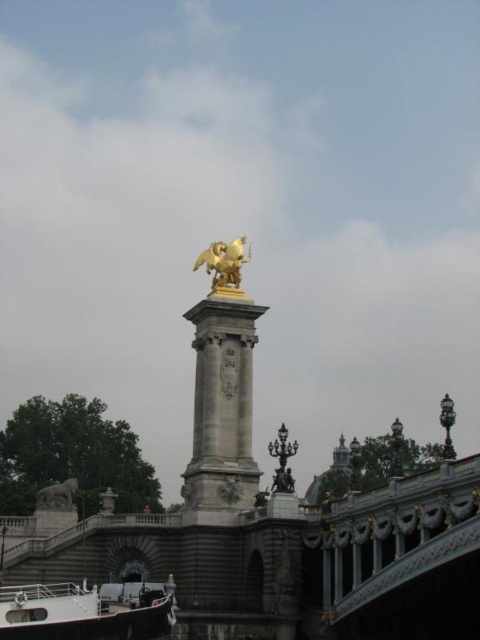
How much distance is there between gold polished statue at center and gold polished statue at upper center?

gold polished statue at center and gold polished statue at upper center are 7.09 meters apart from each other.

Is gold polished statue at center smaller than gold polished statue at upper center?

Actually, gold polished statue at center might be larger than gold polished statue at upper center.

You are a GUI agent. You are given a task and a screenshot of the screen. Output one action in this format:
    pyautogui.click(x=<x>, y=<y>)
    Task: Click on the gold polished statue at center
    
    Given the screenshot: What is the action you would take?
    pyautogui.click(x=223, y=385)

This screenshot has width=480, height=640. What are the coordinates of `gold polished statue at center` in the screenshot? It's located at (223, 385).

Which is above, gold polished statue at center or white matte boat at lower left?

gold polished statue at center

Is point (190, 508) closer to camera compared to point (116, 625)?

No, (190, 508) is further to viewer.

Between point (237, 480) and point (140, 624), which one is positioned behind?

Positioned behind is point (237, 480).

Find the location of a particular element. The height and width of the screenshot is (640, 480). gold polished statue at center is located at coordinates (223, 385).

Can you confirm if white matte boat at lower left is positioned above gold polished statue at upper center?

Incorrect, white matte boat at lower left is not positioned above gold polished statue at upper center.

Can you confirm if white matte boat at lower left is positioned below gold polished statue at upper center?

Correct, white matte boat at lower left is located below gold polished statue at upper center.

Is point (26, 593) positioned behind point (239, 240)?

No, (26, 593) is closer to viewer.

Locate an element on the screen. Image resolution: width=480 pixels, height=640 pixels. white matte boat at lower left is located at coordinates (82, 612).